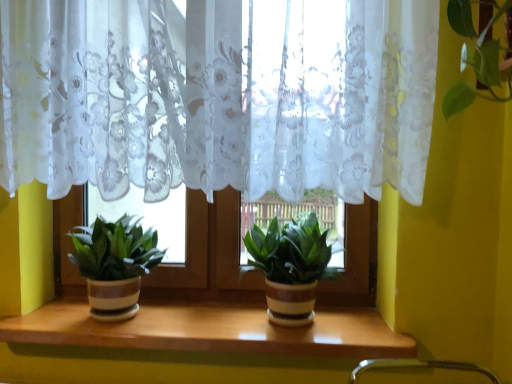
The height and width of the screenshot is (384, 512). I want to click on free space to the left of green matte plant pot at center, the first houseplant in the right-to-left sequence, so click(x=201, y=320).